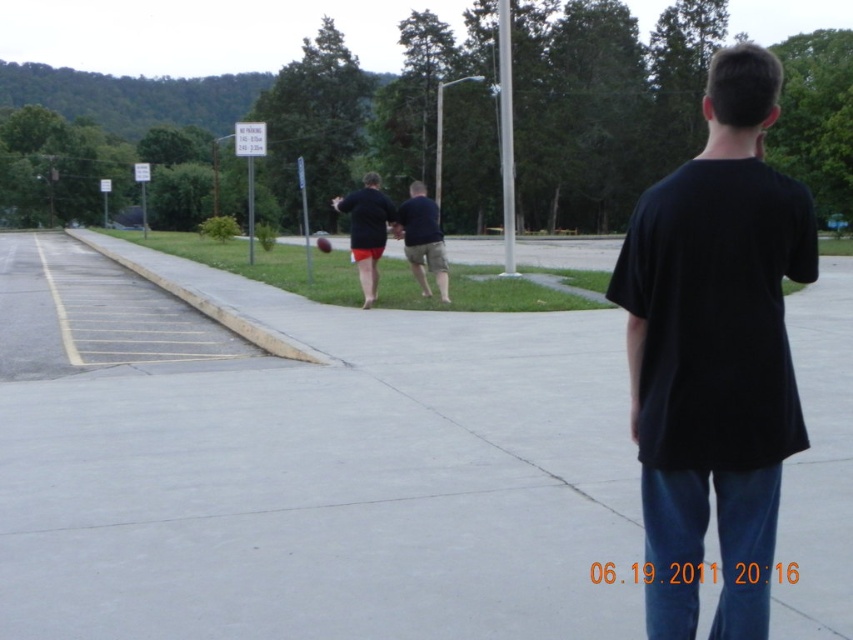
Who is higher up, gray concrete pavement at center or black cotton shirt at center?

gray concrete pavement at center

Is point (573, 460) closer to viewer compared to point (699, 387)?

No, it is not.

Which is in front, point (392, 324) or point (779, 349)?

Point (779, 349)

Find the location of `gray concrete pavement at center`. gray concrete pavement at center is located at coordinates (303, 461).

Does black cotton shirt at center appear over matte black shirt at center?

Actually, black cotton shirt at center is below matte black shirt at center.

Is black cotton shirt at center smaller than matte black shirt at center?

Yes, black cotton shirt at center is smaller than matte black shirt at center.

Identify the location of black cotton shirt at center. The image size is (853, 640). (715, 353).

Is gray concrete pavement at center below dark blue shirt at center?

Indeed, gray concrete pavement at center is positioned under dark blue shirt at center.

Is point (160, 605) positioned before point (413, 204)?

Yes, point (160, 605) is closer to viewer.

The height and width of the screenshot is (640, 853). In order to click on gray concrete pavement at center in this screenshot , I will do `click(303, 461)`.